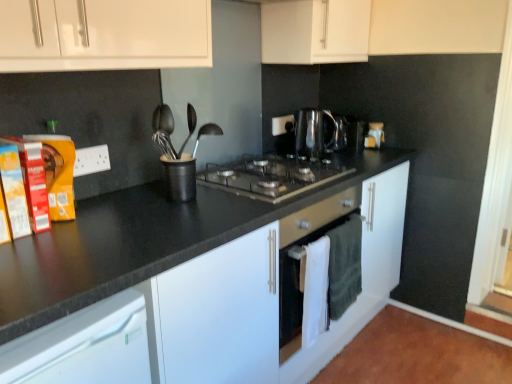
This screenshot has height=384, width=512. In order to click on vacant area that is situated to the right of black matte utensil holder at center in this screenshot , I will do `click(226, 197)`.